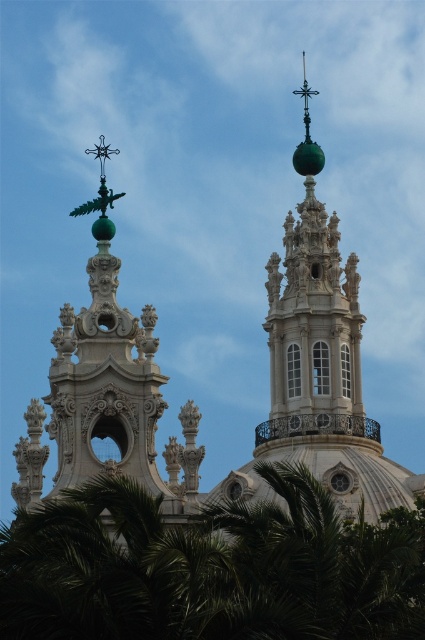
You are an architect analyzing the spatial arrangement of the towers. Which object, the green leafy tree at lower left or the green polished dome at upper left, is positioned higher in the image?

The green polished dome at upper left is positioned higher in the image than the green leafy tree at lower left.

You are standing in front of the towers and want to take a photo that includes both the green leafy tree at lower left and the green polished dome at upper left. Which object should you focus on first to ensure both are in sharp focus?

You should focus on the green leafy tree at lower left first because it is closer to the viewer than the green polished dome at upper left, so adjusting focus from near to far will help both be in focus.